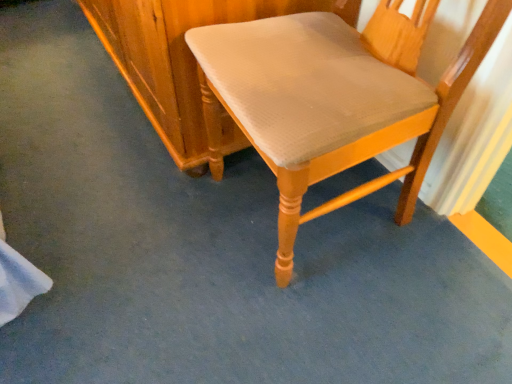
Question: Should I look upward or downward to see light brown wood chair at center?

Choices:
 (A) up
 (B) down

Answer: (A)